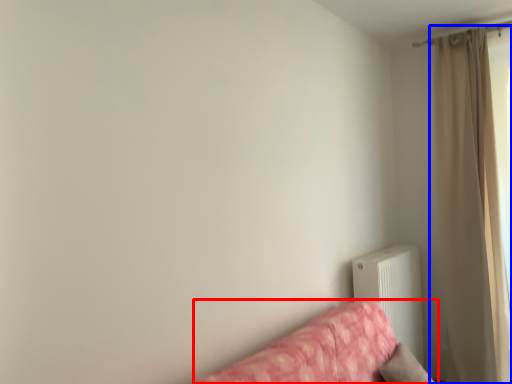
Question: Which of the following is the closest to the observer, studio couch (highlighted by a red box) or curtain (highlighted by a blue box)?

Choices:
 (A) studio couch
 (B) curtain

Answer: (A)